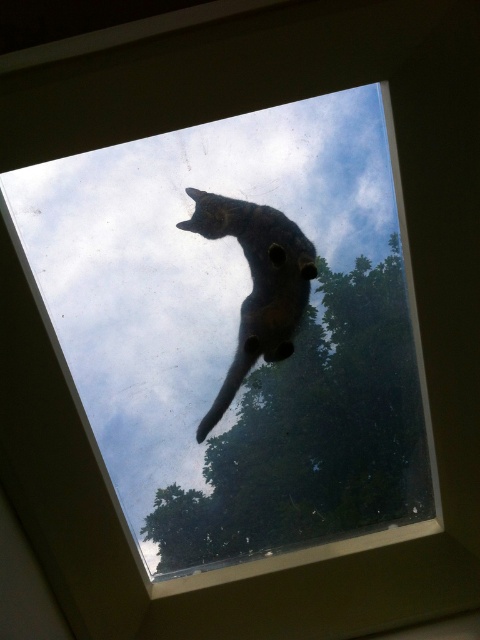
Is green leafy tree at upper center positioned at the back of shiny black cat at upper center?

Yes.

What do you see at coordinates (312, 433) in the screenshot? The image size is (480, 640). I see `green leafy tree at upper center` at bounding box center [312, 433].

Is point (385, 515) in front of point (260, 353)?

No, (385, 515) is behind (260, 353).

The height and width of the screenshot is (640, 480). Find the location of `green leafy tree at upper center`. green leafy tree at upper center is located at coordinates (312, 433).